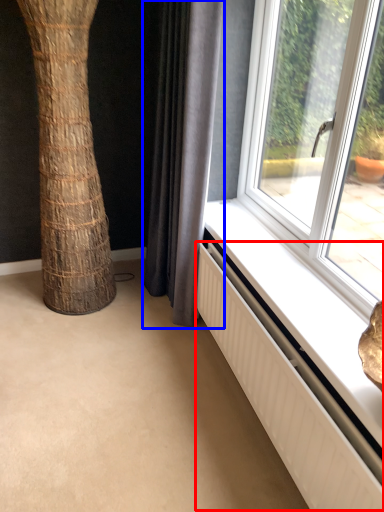
Question: Which object appears farthest to the camera in this image, radiator (highlighted by a red box) or curtain (highlighted by a blue box)?

Choices:
 (A) radiator
 (B) curtain

Answer: (B)